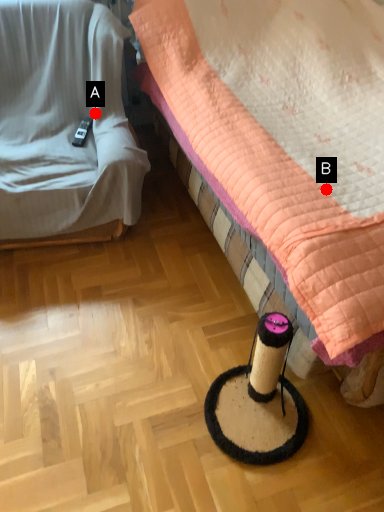
Question: Two points are circled on the image, labeled by A and B beside each circle. Among these points, which one is farthest from the camera?

Choices:
 (A) A is further
 (B) B is further

Answer: (A)